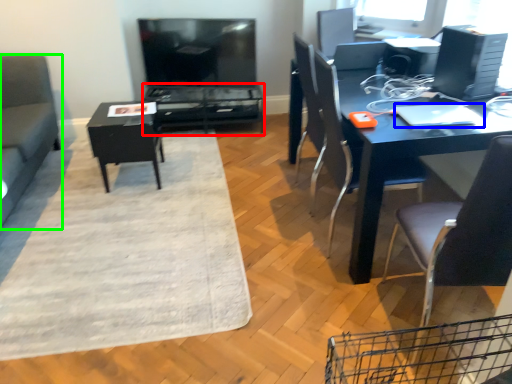
Question: Estimate the real-world distances between objects in this image. Which object is farther from table (highlighted by a red box), laptop (highlighted by a blue box) or studio couch (highlighted by a green box)?

Choices:
 (A) laptop
 (B) studio couch

Answer: (A)